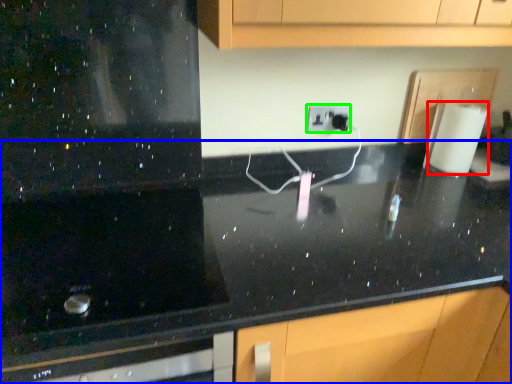
Question: Which object is positioned closest to paper towel (highlighted by a red box)? Select from countertop (highlighted by a blue box) and electric outlet (highlighted by a green box).

Choices:
 (A) countertop
 (B) electric outlet

Answer: (B)